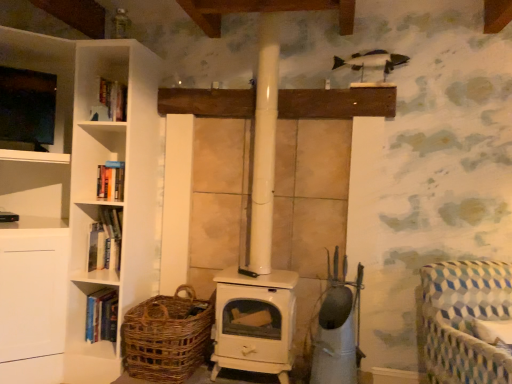
Question: From the image's perspective, is hardcover book at left, which appears as the first book when viewed from the top, above or below blue and white checkered fabric rocking chair at lower right?

Choices:
 (A) above
 (B) below

Answer: (A)

Question: Is hardcover book at left, the 2th book when ordered from bottom to top, taller or shorter than blue and white checkered fabric rocking chair at lower right?

Choices:
 (A) tall
 (B) short

Answer: (B)

Question: Based on their relative distances, which object is farther from the woven brown basket at lower left?

Choices:
 (A) blue and white checkered fabric rocking chair at lower right
 (B) hardcover book at left, the 2th book when ordered from bottom to top
 (C) matte black tv at left
 (D) hardcover book at left, which is counted as the 2th book, starting from the top

Answer: (C)

Question: Which is farther from the woven brown basket at lower left?

Choices:
 (A) hardcover book at left, which is counted as the 2th book, starting from the top
 (B) hardcover book at left, which appears as the first book when viewed from the top
 (C) blue and white checkered fabric rocking chair at lower right
 (D) matte black tv at left

Answer: (D)